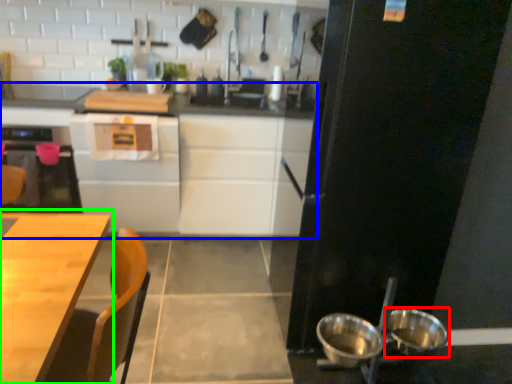
Question: Which is farther away from bowl (highlighted by a red box)? cabinetry (highlighted by a blue box) or table (highlighted by a green box)?

Choices:
 (A) cabinetry
 (B) table

Answer: (A)